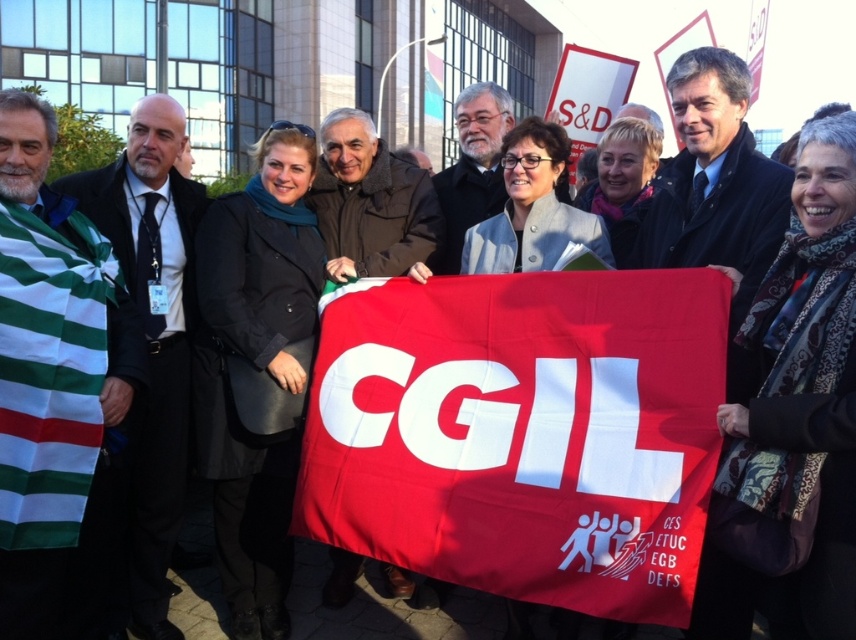
Question: Which object is farther from the camera taking this photo?

Choices:
 (A) dark gray suit at left
 (B) dark blue wool coat at center

Answer: (A)

Question: In this image, where is dark blue wool coat at center located relative to dark brown leather jacket at center?

Choices:
 (A) right
 (B) left

Answer: (A)

Question: Is red fabric flag at center positioned behind dark gray suit at left?

Choices:
 (A) no
 (B) yes

Answer: (A)

Question: Is red fabric flag at center to the left of dark blue wool coat at center from the viewer's perspective?

Choices:
 (A) no
 (B) yes

Answer: (B)

Question: Which object appears farthest from the camera in this image?

Choices:
 (A) dark blue wool coat at center
 (B) red fabric flag at center
 (C) green and white striped scarf at left

Answer: (C)

Question: Which point is farther to the camera?

Choices:
 (A) (129, 129)
 (B) (697, 96)

Answer: (A)